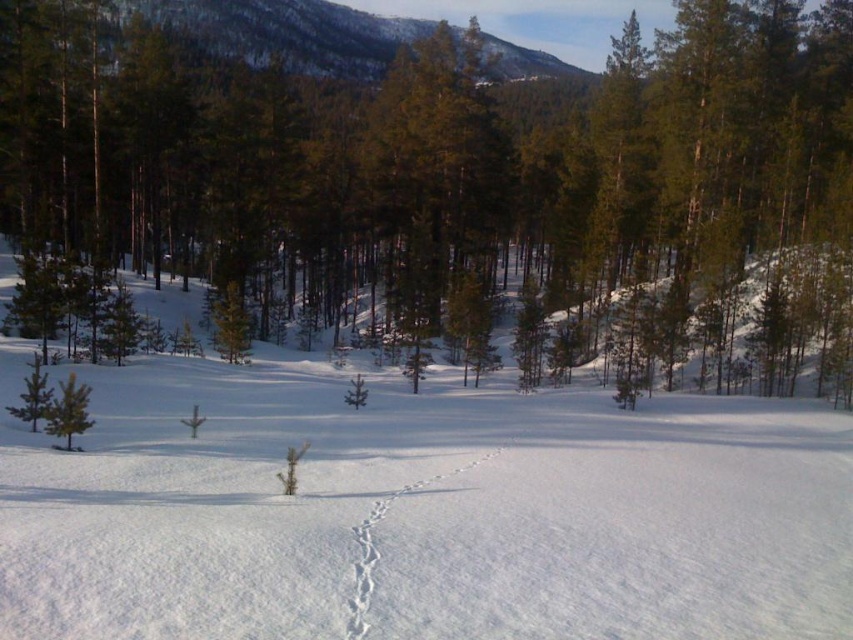
You are a wildlife photographer trying to capture the animal tracks in the snow. You want to focus on the point closer to the camera. Which point should you choose between point (158, 540) and point (86, 403)?

Point (158, 540) is closer to the camera than point (86, 403), so you should focus on point (158, 540).

You are an animal tracker in the winter forest. You see the white powdery snow trail at center and the green matte tree at lower left. Which object is nearer to you?

The white powdery snow trail at center is closer to the viewer than the green matte tree at lower left.

You are a hiker who wants to take a photo of the green matte tree at center and the white fluffy snow at center. Which object should you focus on first if you want both to be in clear focus?

You should focus on the green matte tree at center first because it is closer to you than the white fluffy snow at center. By focusing on the closer object, the background object will also be in focus due to the depth of field.